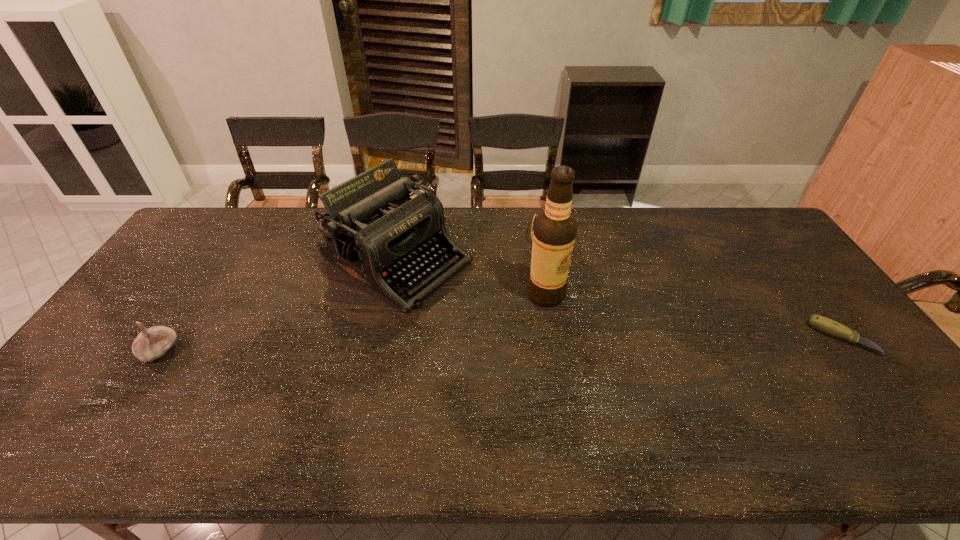
Identify the location of garlic. (150, 344).

Image resolution: width=960 pixels, height=540 pixels. What are the coordinates of `the third tallest object` in the screenshot? It's located at (150, 344).

Locate an element on the screen. This screenshot has height=540, width=960. the shortest object is located at coordinates (828, 326).

Locate an element on the screen. the rightmost object is located at coordinates (828, 326).

At what (x,y) coordinates should I click in order to perform the action: click on the second tallest object. Please return your answer as a coordinate pair (x, y). The height and width of the screenshot is (540, 960). Looking at the image, I should click on (373, 231).

The image size is (960, 540). Identify the location of typewriter. (373, 231).

The height and width of the screenshot is (540, 960). Identify the location of sunglasses. (536, 215).

I want to click on alcohol, so pyautogui.click(x=554, y=232).

At what (x,y) coordinates should I click in order to perform the action: click on vacant space located on the right of the third shortest object. Please return your answer as a coordinate pair (x, y). Image resolution: width=960 pixels, height=540 pixels. Looking at the image, I should click on (224, 352).

Locate an element on the screen. This screenshot has width=960, height=540. free location located 0.250m on the left of the shortest object is located at coordinates (724, 338).